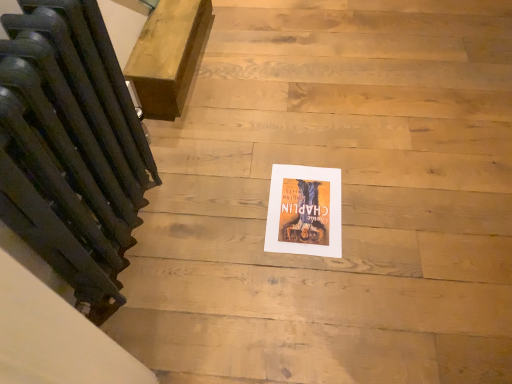
Where is `free location above matte paper poster at center (from a real-world perspective)`? The image size is (512, 384). free location above matte paper poster at center (from a real-world perspective) is located at coordinates (302, 201).